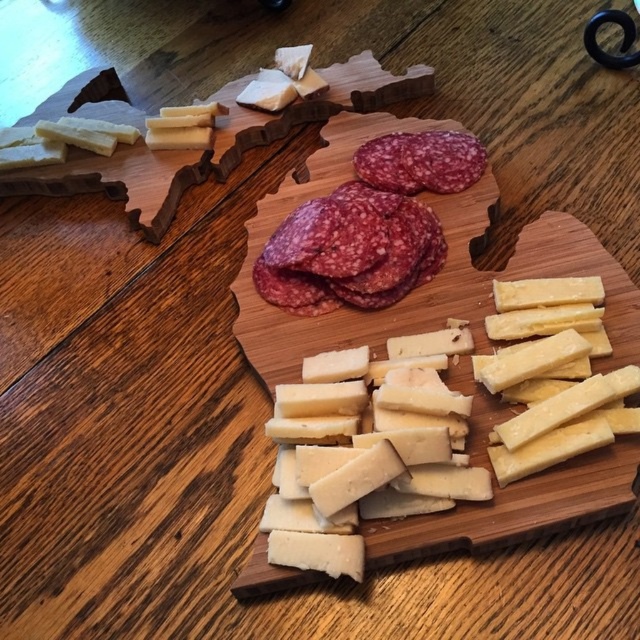
Question: Can you confirm if yellow cheese at center is wider than purple marbled salami at center?

Choices:
 (A) yes
 (B) no

Answer: (A)

Question: Which object appears closest to the camera in this image?

Choices:
 (A) yellow cheese at center
 (B) purple marbled salami at center

Answer: (A)

Question: Can you confirm if yellow cheese at center is positioned to the left of purple marbled salami at center?

Choices:
 (A) yes
 (B) no

Answer: (B)

Question: Can you confirm if yellow cheese at center is bigger than purple marbled salami at center?

Choices:
 (A) no
 (B) yes

Answer: (B)